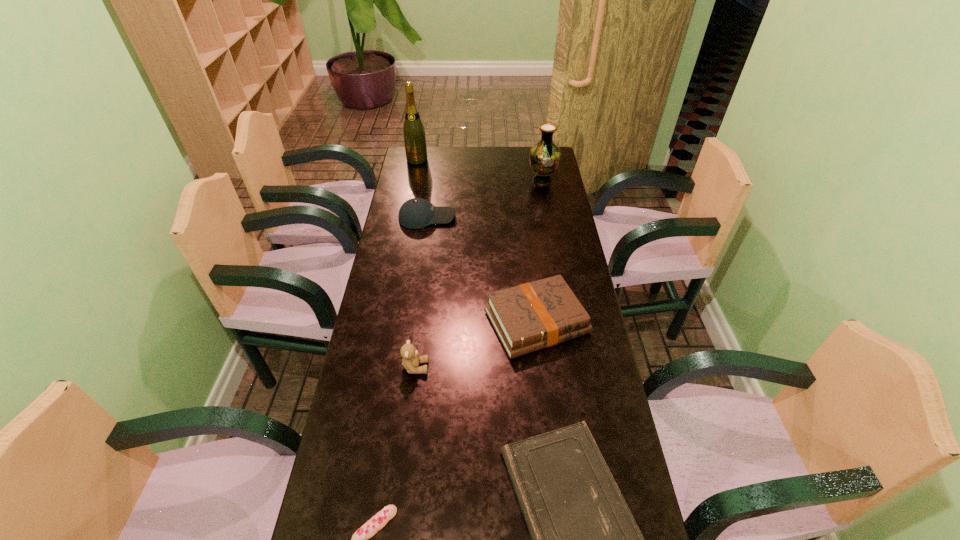
Where is `vacant space that satisfies the following two spatial constraints: 1. on the front-facing side of the third farthest object; 2. on the left side of the hardback book`? vacant space that satisfies the following two spatial constraints: 1. on the front-facing side of the third farthest object; 2. on the left side of the hardback book is located at coordinates (413, 321).